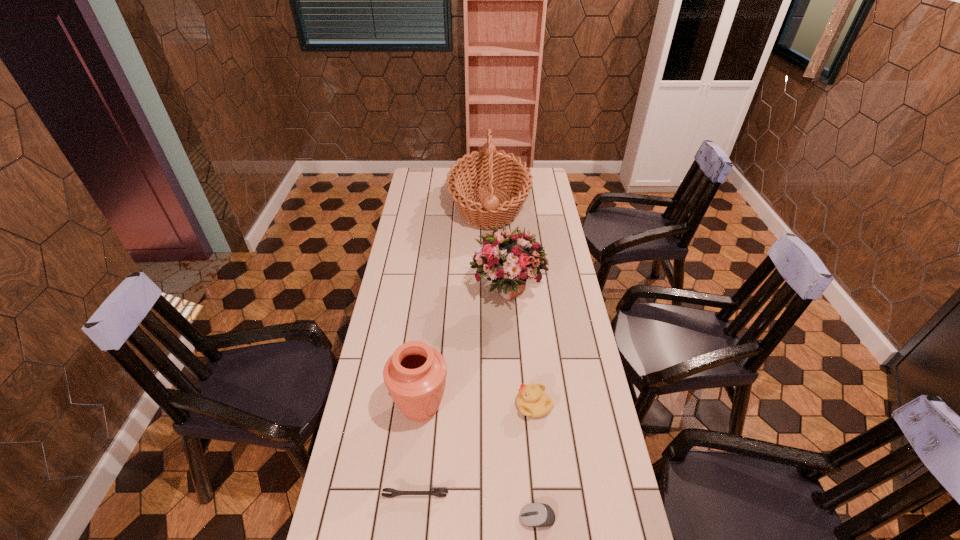
Where is `vase positioned at the left edge`? vase positioned at the left edge is located at coordinates (415, 374).

This screenshot has width=960, height=540. In order to click on wrench at the left edge in this screenshot , I will do `click(439, 492)`.

You are a GUI agent. You are given a task and a screenshot of the screen. Output one action in this format:
    pyautogui.click(x=<x>, y=<y>)
    Task: Click on the basket present at the right edge
    
    Given the screenshot: What is the action you would take?
    pyautogui.click(x=490, y=167)

The height and width of the screenshot is (540, 960). I want to click on bouquet that is at the right edge, so click(x=508, y=258).

This screenshot has width=960, height=540. Find the location of `duckling that is positioned at the right edge`. duckling that is positioned at the right edge is located at coordinates (532, 401).

What are the coordinates of `object situated at the far right corner` in the screenshot? It's located at coord(490,167).

Find the location of a particular element. This screenshot has height=540, width=960. free space at the far edge of the desktop is located at coordinates (481, 186).

In the image, there is a desktop. At what (x,y) coordinates should I click in order to perform the action: click on vacant area at the left edge. Please return your answer as a coordinate pair (x, y). The image size is (960, 540). Looking at the image, I should click on (399, 330).

Where is `vacant space at the right edge of the desktop`? The width and height of the screenshot is (960, 540). vacant space at the right edge of the desktop is located at coordinates (543, 211).

Locate an element on the screen. This screenshot has width=960, height=540. vacant point located between the computer equipment and the farthest object is located at coordinates (514, 362).